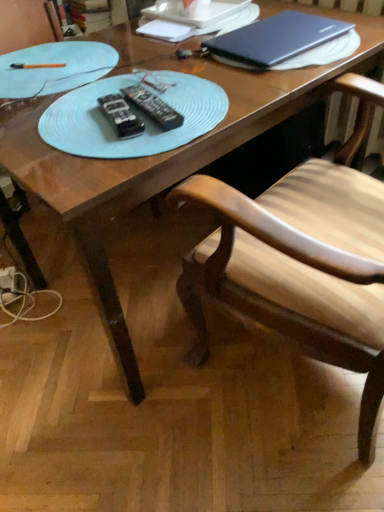
In order to click on free space to the left of black plastic remote at center, the first remote positioned from the left in this screenshot , I will do `click(51, 124)`.